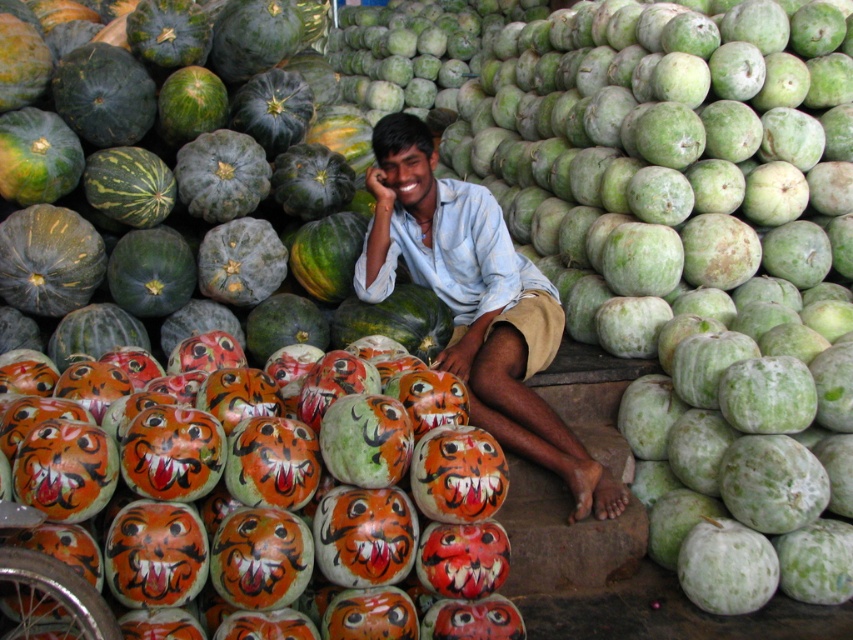
You are a customer at the market and want to buy the painted orange pumpkin at center. The vendor is wearing a light blue shirt at center. Where should you look to find the vendor compared to the pumpkin?

The painted orange pumpkin at center is below the light blue shirt at center, so the vendor wearing the light blue shirt at center is above the pumpkin. Look upwards towards the vendor.

You are a customer at the market and want to find the painted orange pumpkin at center. According to the market layout, where should you look relative to the man?

The painted orange pumpkin at center is located at the coordinates 0.808 on the x axis and 0.321 on the y axis relative to the man.

You are a customer at the market and want to know if the painted orange pumpkin at center is taller than the light blue shirt at center. Can you determine this based on the scene?

The painted orange pumpkin at center is not as tall as the light blue shirt at center, so the light blue shirt at center is taller.